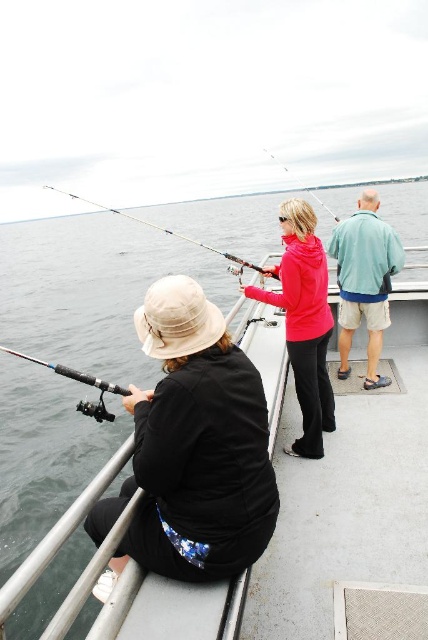
Question: Can you confirm if metallic fishing rod at center is thinner than matte pink hoodie at center?

Choices:
 (A) no
 (B) yes

Answer: (B)

Question: From the image, what is the correct spatial relationship of metallic fishing rod at center in relation to teal fabric jacket at upper right?

Choices:
 (A) above
 (B) below

Answer: (B)

Question: Which point is farther to the camera?

Choices:
 (A) black matte jacket at lower left
 (B) matte pink hoodie at center
 (C) metallic rod at center

Answer: (C)

Question: Which object appears farthest from the camera in this image?

Choices:
 (A) black matte fishing pole at left
 (B) black matte jacket at lower left
 (C) teal fabric jacket at upper right

Answer: (C)

Question: Does matte pink hoodie at center appear under black matte fishing pole at left?

Choices:
 (A) yes
 (B) no

Answer: (B)

Question: Which point is farther from the camera taking this photo?

Choices:
 (A) (368, 275)
 (B) (225, 252)
 (C) (85, 376)

Answer: (B)